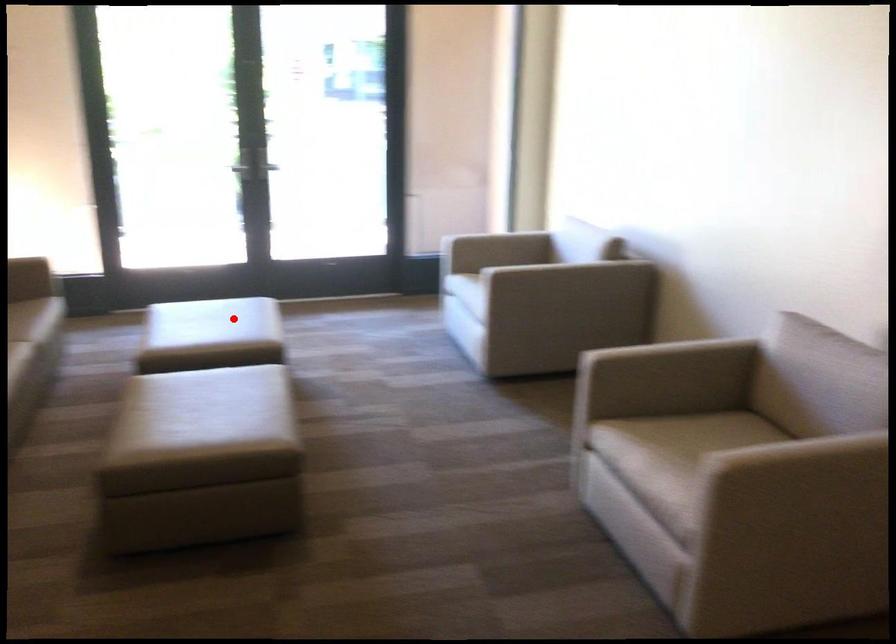
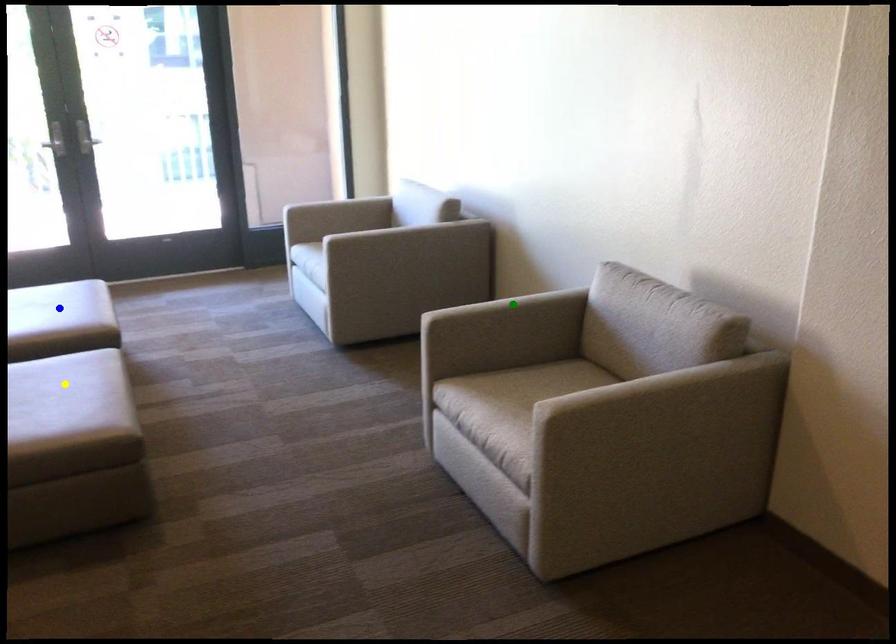
Question: I am providing you with two images of the same scene from different viewpoints. A red point is marked on the first image. You are given multiple points on the second image. Which mark in image 2 goes with the point in image 1?

Choices:
 (A) yellow point
 (B) blue point
 (C) green point

Answer: (B)